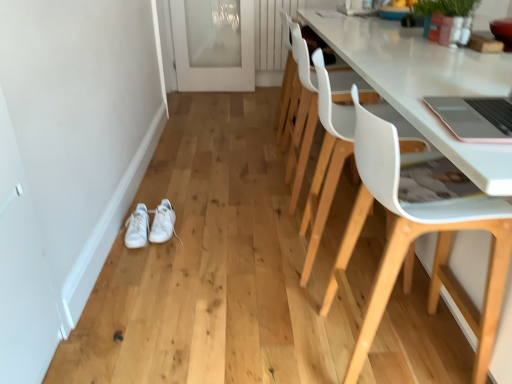
Question: Would you say white plastic chair at right, marked as the second chair in a back-to-front arrangement, is to the left or to the right of white leather sneakers at lower left, which is counted as the 1th footwear, starting from the right, in the picture?

Choices:
 (A) right
 (B) left

Answer: (A)

Question: Considering the positions of point (322, 200) and point (162, 213), is point (322, 200) closer or farther from the camera than point (162, 213)?

Choices:
 (A) closer
 (B) farther

Answer: (A)

Question: Which object is positioned closest to the white leather sneakers at lower left, marked as the 2th footwear in a left-to-right arrangement?

Choices:
 (A) white leather sneakers at lower left, which is counted as the first footwear, starting from the left
 (B) white plastic chair at right, the first chair in the front-to-back sequence
 (C) white plastic chair at right, which appears as the 2th chair when viewed from the front
 (D) white plastic chair at center, the first chair in the back-to-front sequence
 (E) transparent glass door at upper center

Answer: (A)

Question: Considering the real-world distances, which object is farthest from the white leather sneakers at lower left, which is counted as the first footwear, starting from the left?

Choices:
 (A) white plastic chair at right, which is the 3th chair in back-to-front order
 (B) white plastic chair at center, the first chair in the back-to-front sequence
 (C) white plastic chair at right, which appears as the 2th chair when viewed from the front
 (D) transparent glass door at upper center
 (E) white leather sneakers at lower left, marked as the 2th footwear in a left-to-right arrangement

Answer: (D)